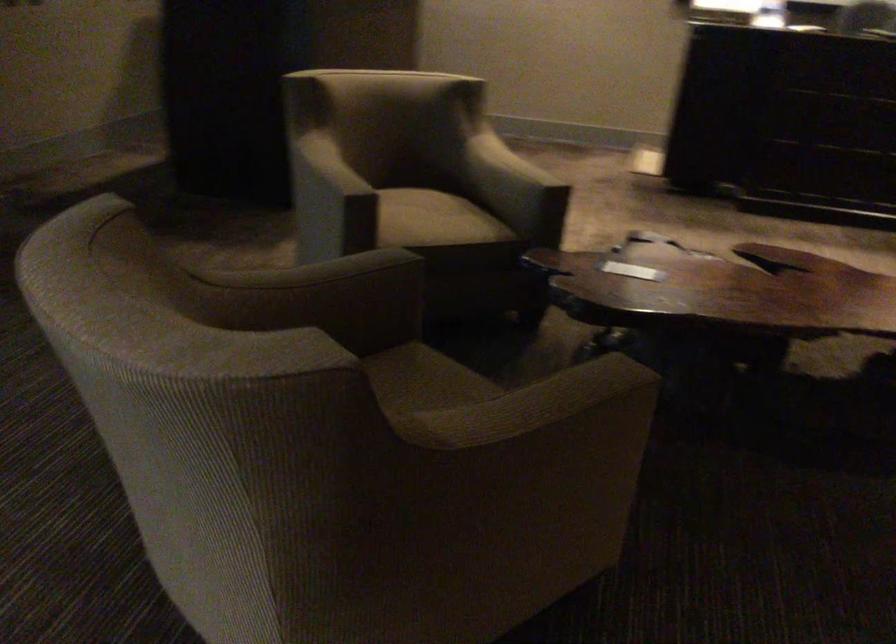
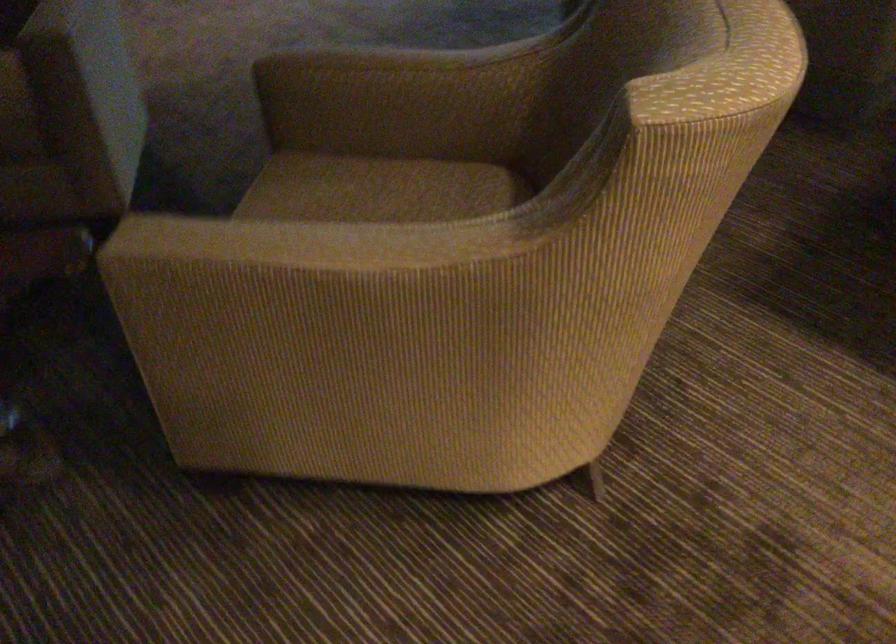
Find the pixel in the second image that matches [416,216] in the first image.

(380, 187)